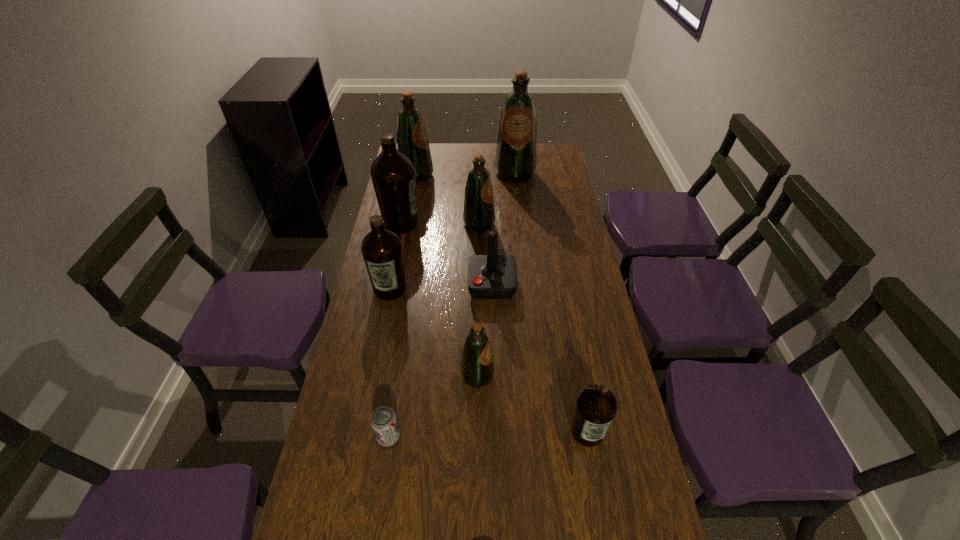
In order to click on free spot between the shortest object and the leftmost green olive oil in this screenshot , I will do `click(402, 306)`.

Locate an element on the screen. The width and height of the screenshot is (960, 540). free space between the second farthest brown olive oil and the smallest green olive oil is located at coordinates (434, 332).

Image resolution: width=960 pixels, height=540 pixels. What are the coordinates of `free spot between the second biggest green olive oil and the third nearest object` in the screenshot? It's located at (447, 275).

Locate an element on the screen. free space that is in between the farthest brown olive oil and the joystick is located at coordinates (446, 254).

Identify the location of free space between the biggest brown olive oil and the shortest object. (395, 330).

Where is `empty location between the shortest object and the biggest green olive oil`? The width and height of the screenshot is (960, 540). empty location between the shortest object and the biggest green olive oil is located at coordinates (452, 305).

Locate an element on the screen. object that is the second closest to the third smallest green olive oil is located at coordinates (479, 215).

Identify which object is the eighth closest to the joystick. Please provide its 2D coordinates. Your answer should be formatted as a tuple, i.e. [(x, y)], where the tuple contains the x and y coordinates of a point satisfying the conditions above.

[(412, 140)]

Identify which olive oil is the fifth nearest to the farthest brown olive oil. Please provide its 2D coordinates. Your answer should be formatted as a tuple, i.e. [(x, y)], where the tuple contains the x and y coordinates of a point satisfying the conditions above.

[(477, 369)]

At what (x,y) coordinates should I click in order to perform the action: click on olive oil that is the fifth closest to the joystick. Please return your answer as a coordinate pair (x, y). The image size is (960, 540). Looking at the image, I should click on (596, 406).